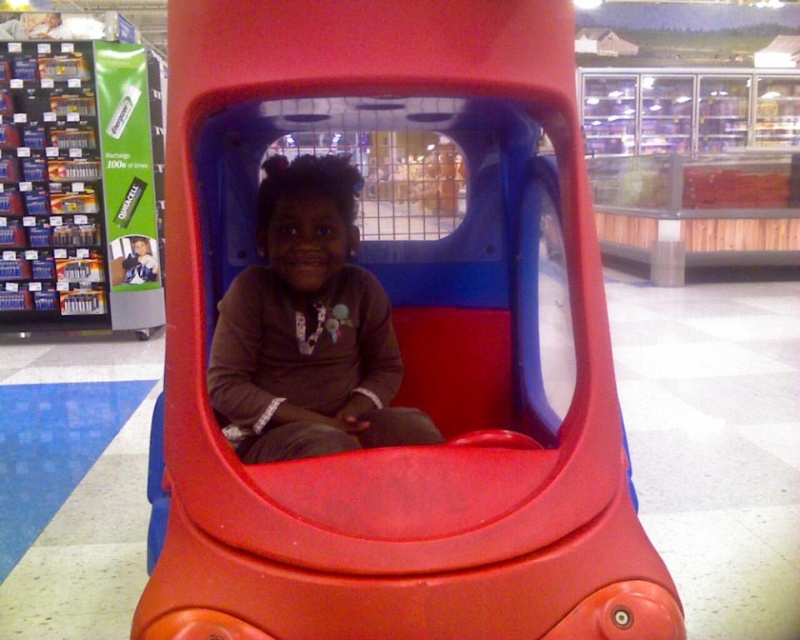
You are a customer in a supermarket. You want to locate the matte plastic toy car at center. Where should you look?

You should look at point (400, 346) to find the matte plastic toy car at center.

You are a customer in a store and see the matte plastic toy car at center and the matte brown shirt at center. Which item is positioned to the right side of the other?

The matte plastic toy car at center is to the right of the matte brown shirt at center.